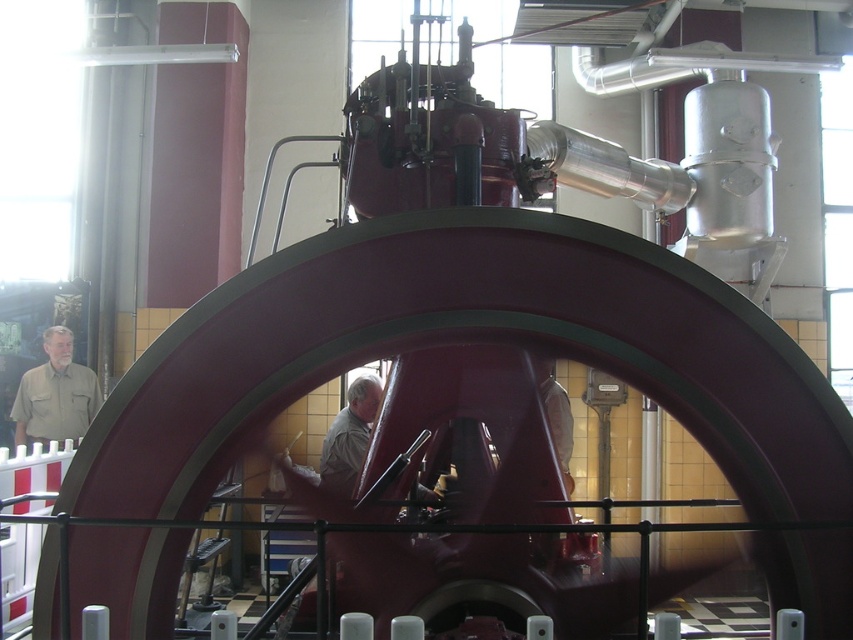
Question: Considering the relative positions of khaki shirt at left and light beige shirt at center in the image provided, where is khaki shirt at left located with respect to light beige shirt at center?

Choices:
 (A) left
 (B) right

Answer: (A)

Question: Among these points, which one is nearest to the camera?

Choices:
 (A) (352, 456)
 (B) (19, 433)

Answer: (A)

Question: Which point appears closest to the camera in this image?

Choices:
 (A) (49, 387)
 (B) (331, 465)

Answer: (B)

Question: In this image, where is khaki shirt at left located relative to light beige shirt at center?

Choices:
 (A) left
 (B) right

Answer: (A)

Question: Does khaki shirt at left have a greater width compared to light beige shirt at center?

Choices:
 (A) no
 (B) yes

Answer: (B)